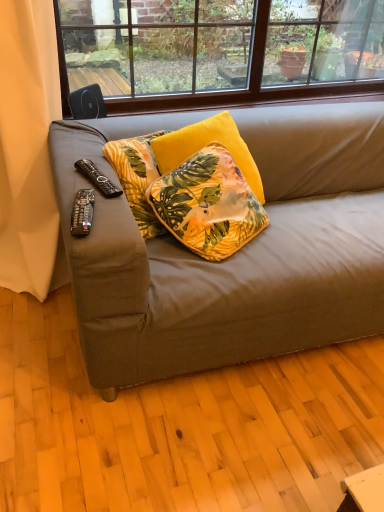
Question: From a real-world perspective, is beige fabric curtain at left above or below black plastic remote control at lower left, the first remote control from the bottom?

Choices:
 (A) below
 (B) above

Answer: (A)

Question: From the image's perspective, is beige fabric curtain at left above or below black plastic remote control at lower left, which is counted as the second remote control, starting from the top?

Choices:
 (A) below
 (B) above

Answer: (B)

Question: Which of these objects is positioned farthest from the beige fabric curtain at left?

Choices:
 (A) velvet floral pillow at center
 (B) matte brown fabric couch at center
 (C) black plastic remote control at lower left, which is the 1th remote control in front-to-back order
 (D) black plastic remote at left, which appears as the 2th remote control when ordered from the bottom

Answer: (C)

Question: Based on their relative distances, which object is farther from the matte brown fabric couch at center?

Choices:
 (A) beige fabric curtain at left
 (B) velvet floral pillow at center
 (C) black plastic remote control at lower left, which is the 1th remote control in front-to-back order
 (D) black plastic remote at left, which ranks as the first remote control in back-to-front order

Answer: (A)